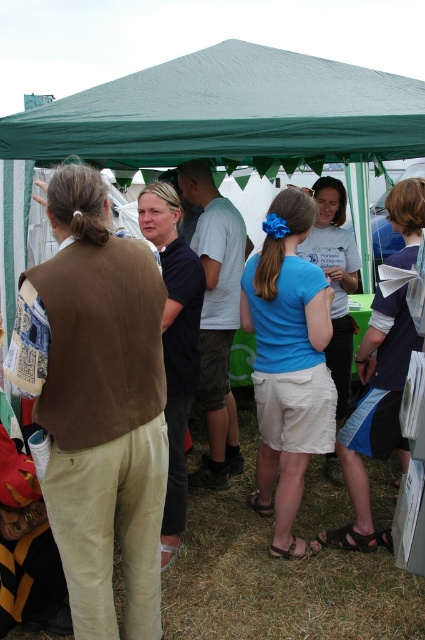
Looking at this image, you are standing at the entrance of the green canopy tent and want to reach the point marked as point [204,173]. There is an obstacle at point [326,100]. Will you need to go around the obstacle to reach your destination?

Yes, you will need to go around the obstacle at point [326,100] because it is in front of your destination point [204,173], blocking the direct path.

You are planning to set up a new tent under the green fabric canopy at upper center and the blue fabric tent at center. Based on their heights, which tent would allow more vertical space for your new setup?

The blue fabric tent at center is taller than the green fabric canopy at upper center, so it would provide more vertical space for your new setup.